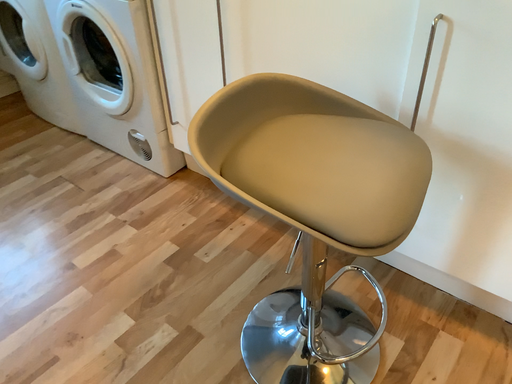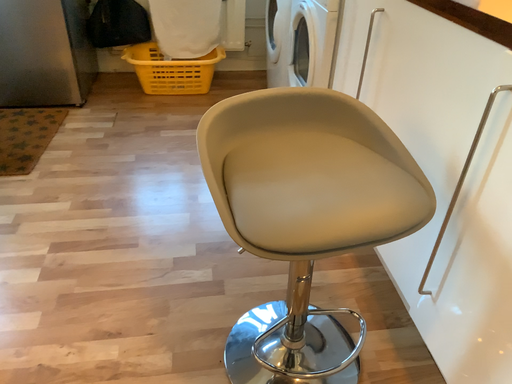
Question: How did the camera likely rotate when shooting the video?

Choices:
 (A) rotated downward
 (B) rotated upward

Answer: (B)